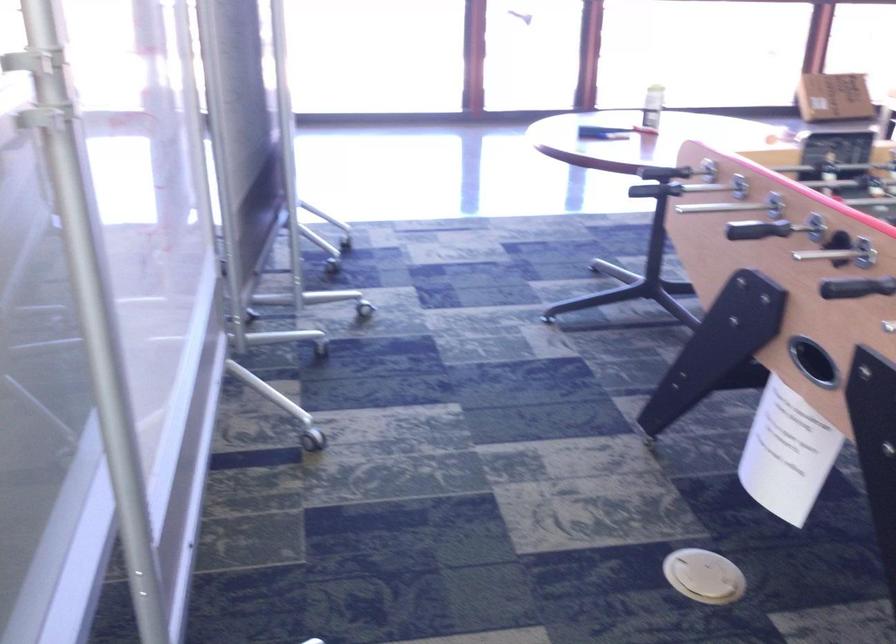
Find where to retriev the foosball table hole. Please return your answer as a coordinate pair (x, y).

(321, 346)